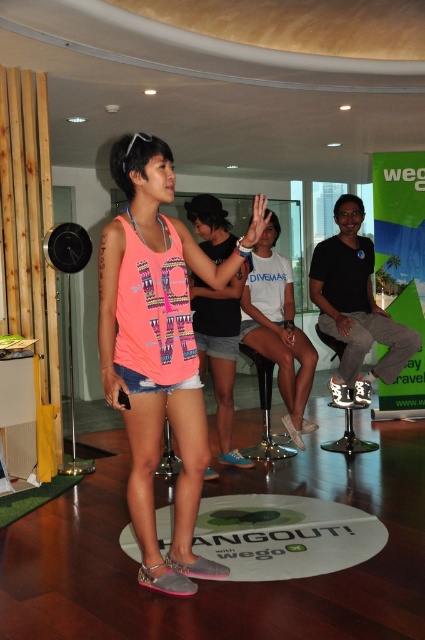
Question: Estimate the real-world distances between objects in this image. Which object is farther from the white rubber mat at center?

Choices:
 (A) neon pink fabric tank top at center
 (B) metallic silver stool at center

Answer: (B)

Question: In this image, where is white matte t-shirt at center located relative to pink fabric tank top at center?

Choices:
 (A) left
 (B) right

Answer: (B)

Question: Among these points, which one is nearest to the camera?

Choices:
 (A) (170, 522)
 (B) (303, 352)
 (C) (164, 161)

Answer: (C)

Question: Which point is closer to the camera?

Choices:
 (A) metallic silver stool at center
 (B) white matte t-shirt at center
 (C) white rubber mat at center

Answer: (C)

Question: Can you confirm if neon pink fabric tank top at center is positioned to the left of white matte t-shirt at center?

Choices:
 (A) yes
 (B) no

Answer: (A)

Question: In this image, where is white rubber mat at center located relative to pink fabric tank top at center?

Choices:
 (A) below
 (B) above

Answer: (A)